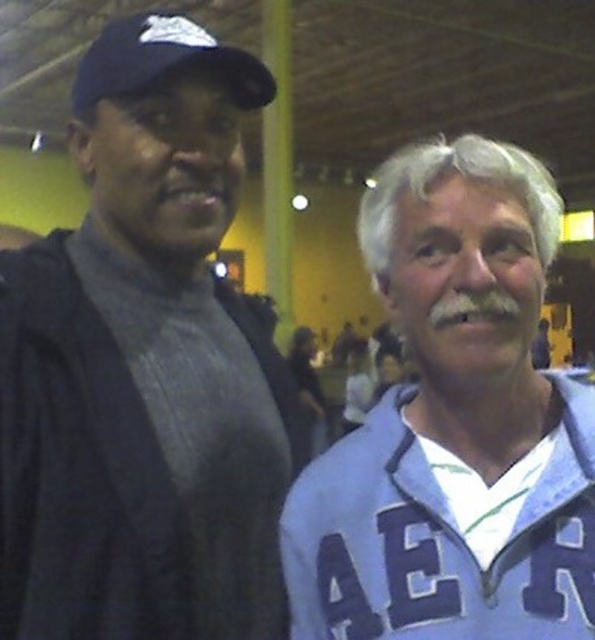
You are at an indoor event and want to take a photo of the dark gray knit sweater at left and the black matte baseball cap at upper left. Which object should you focus on first to ensure both are in focus?

The dark gray knit sweater at left is closer to the viewer than the black matte baseball cap at upper left, so you should focus on the dark gray knit sweater at left first to ensure both are in focus.

You are at an indoor event and see two people. The person on the left is wearing a dark jacket over a gray shirt, and the person on the right is in a blue sports jersey. There is a point marked at coordinates (143, 368). Which object is located at that point?

The point at coordinates (143, 368) corresponds to the dark gray knit sweater at left.